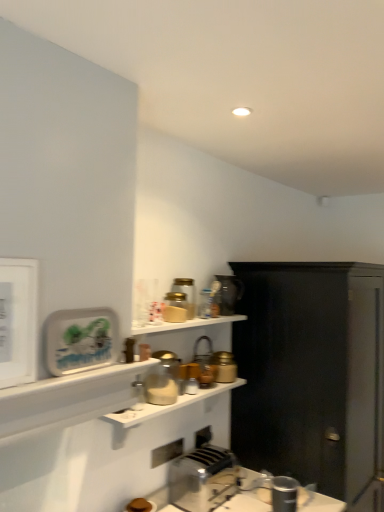
Question: In terms of size, does metallic faucet at upper center, the 3th appliance in the bottom-to-top sequence, appear bigger or smaller than metallic silver toaster at upper center, the seventh appliance in the front-to-back sequence?

Choices:
 (A) big
 (B) small

Answer: (B)

Question: In terms of width, does metallic faucet at upper center, the 5th appliance positioned from the front, look wider or thinner when compared to metallic silver toaster at upper center, which is the 7th appliance in bottom-to-top order?

Choices:
 (A) thin
 (B) wide

Answer: (A)

Question: Estimate the real-world distances between objects in this image. Which object is farther from the matte gold jar at center, marked as the 6th appliance in a top-to-bottom arrangement?

Choices:
 (A) matte white plate at upper left, which is the first appliance from front to back
 (B) matte white shelf at lower left, which appears as the second shelf when ordered from the bottom
 (C) silver metallic toaster at lower center
 (D) metallic silver toaster at upper center, placed as the first appliance when sorted from top to bottom
 (E) translucent glass jar at upper center, which is the 6th appliance in bottom-to-top order

Answer: (A)

Question: Which of these objects is positioned closest to the metallic silver toaster at lower center, which ranks as the seventh appliance in top-to-bottom order?

Choices:
 (A) black matte cabinet at right
 (B) matte gold jar at center, marked as the 6th appliance in a top-to-bottom arrangement
 (C) silver metallic toaster at lower center
 (D) matte glass jar at center, positioned as the second shelf in top-to-bottom order
 (E) metallic silver toaster at upper center, which is the 7th appliance in bottom-to-top order

Answer: (C)